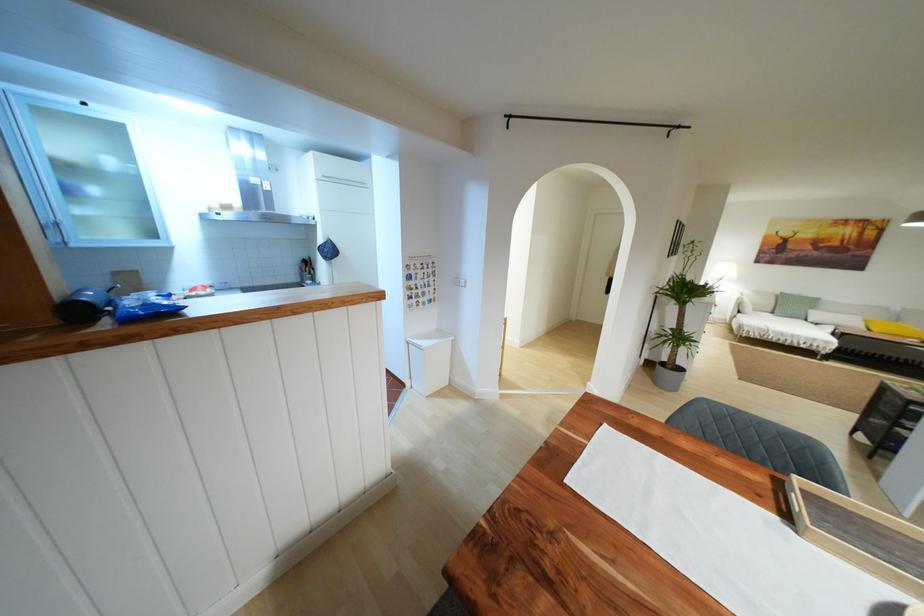
The width and height of the screenshot is (924, 616). In order to click on sofa sitting surface in this screenshot , I will do `click(784, 323)`.